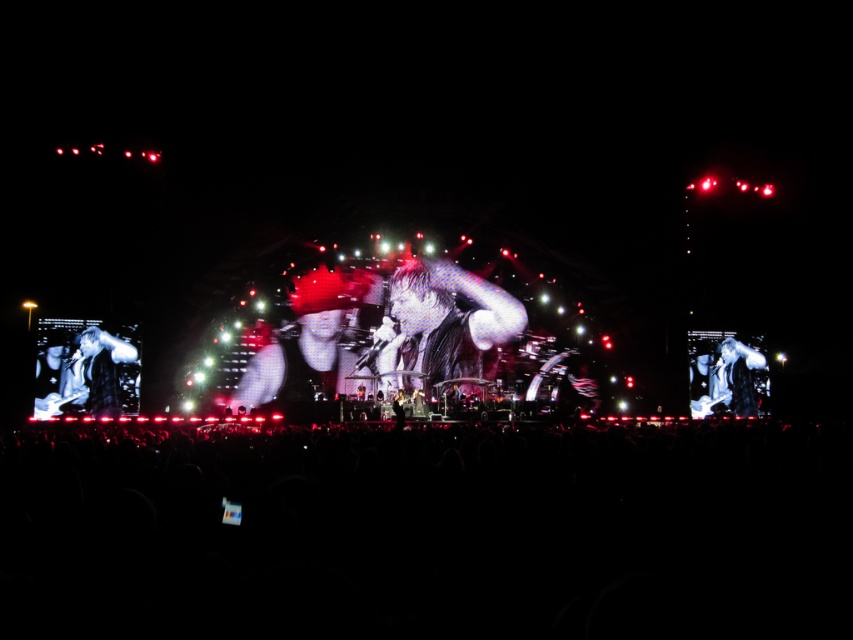
Who is positioned more to the right, black matte crowd at lower center or shiny black leather jacket at center?

black matte crowd at lower center

Measure the distance between black matte crowd at lower center and shiny black leather jacket at center.

The distance of black matte crowd at lower center from shiny black leather jacket at center is 33.85 meters.

Locate an element on the screen. black matte crowd at lower center is located at coordinates (430, 532).

Which is below, dark hair at left or shiny black microphone at center?

Positioned lower is shiny black microphone at center.

Which of these two, dark hair at left or shiny black microphone at center, stands taller?

With more height is dark hair at left.

Which is in front, point (107, 353) or point (741, 390)?

Point (107, 353) is more forward.

Where is `dark hair at left`? This screenshot has width=853, height=640. dark hair at left is located at coordinates (102, 369).

Who is lower down, shiny black hair at center or shiny black microphone at center?

shiny black microphone at center is lower down.

Can you confirm if shiny black hair at center is bigger than shiny black microphone at center?

Yes.

Where is `shiny black hair at center`? This screenshot has width=853, height=640. shiny black hair at center is located at coordinates (323, 310).